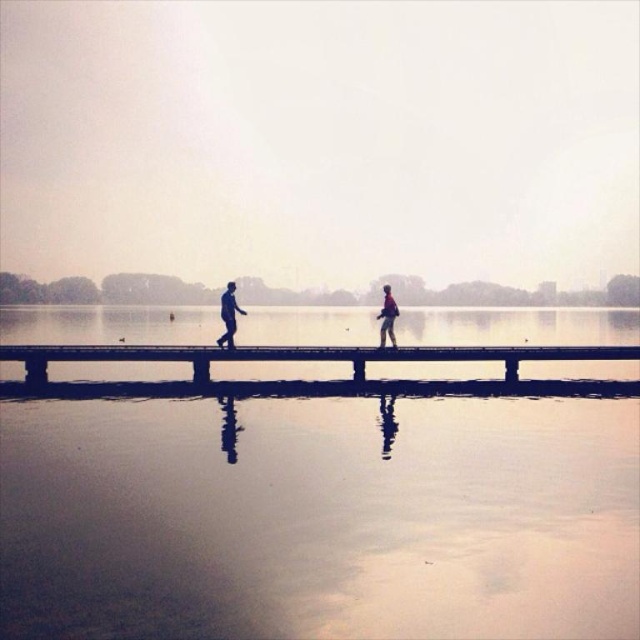
You are a photographer aiming to capture the reflection of both the smooth wooden dock at center and the matte black figure at center in the water. Given that the dock is larger, which object will have a more prominent reflection in the water?

The smooth wooden dock at center has a larger size than the matte black figure at center, so its reflection will be more prominent in the water.

You are a photographer standing at the end of the pier closest to the trees. You want to take a photo of the matte black figure at center. Which direction should you move to get the best reflection of the figure in the water?

Since the matte black figure at center is positioned at coordinates approximately 0.494 on the x and 0.358 on the y axis, you should move directly towards the figure along the pier to ensure its reflection is centered and clear in the water.

You are standing on the smooth wooden dock at center and want to reach the matte gray jacket at center. Is the jacket within your immediate reach based on their sizes?

The smooth wooden dock at center is shorter than the matte gray jacket at center, so the jacket may be within reach depending on your arm length, but the dock itself is not taller than the jacket.